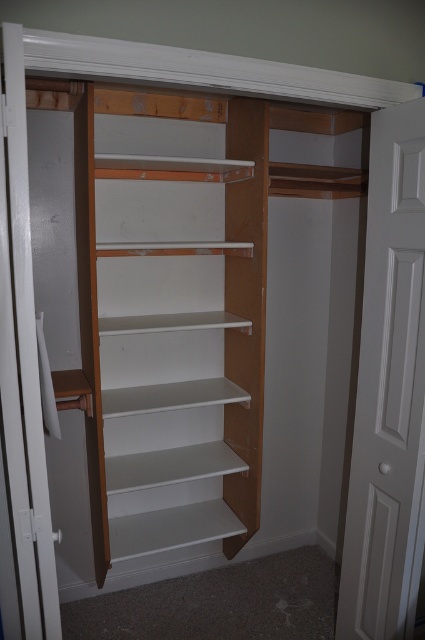
Question: Is white painted wood door at right to the left of white glossy door at left from the viewer's perspective?

Choices:
 (A) no
 (B) yes

Answer: (A)

Question: Which point appears farthest from the camera in this image?

Choices:
 (A) (192, 449)
 (B) (382, 513)
 (C) (11, 440)

Answer: (A)

Question: Does white painted wood door at right come in front of white glossy door at left?

Choices:
 (A) yes
 (B) no

Answer: (B)

Question: Does white painted wood bookshelf at center have a larger size compared to white glossy door at left?

Choices:
 (A) yes
 (B) no

Answer: (A)

Question: Which of the following is the farthest from the observer?

Choices:
 (A) (254, 404)
 (B) (6, 58)

Answer: (A)

Question: Which object is positioned farthest from the white painted wood door at right?

Choices:
 (A) white painted wood bookshelf at center
 (B) white glossy door at left

Answer: (B)